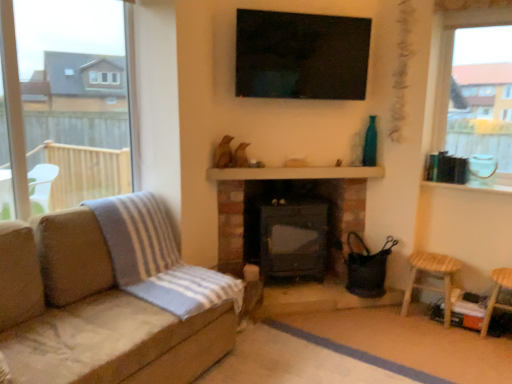
At what (x,y) coordinates should I click in order to perform the action: click on free space above black glossy tv at upper center (from a real-world perspective). Please return your answer as a coordinate pair (x, y). The height and width of the screenshot is (384, 512). Looking at the image, I should click on (295, 5).